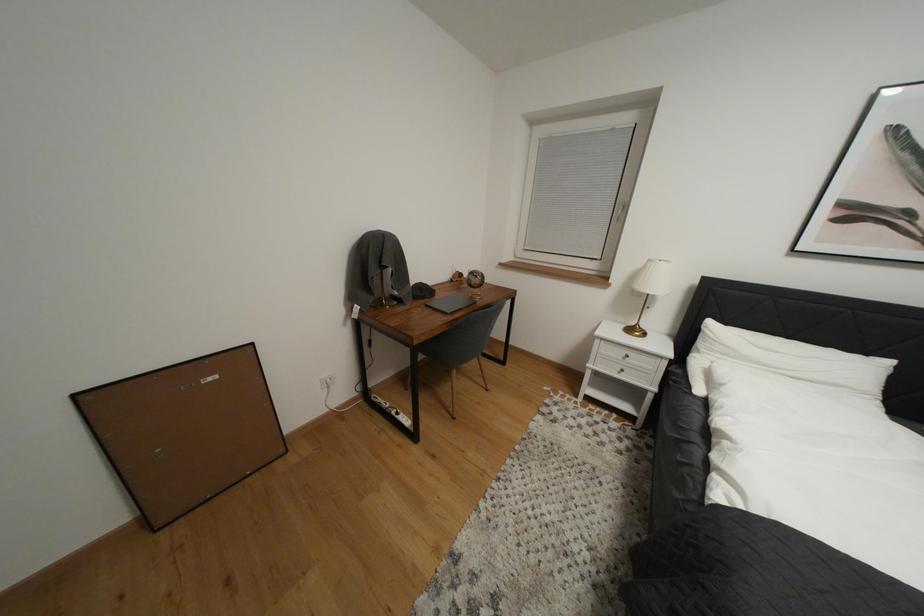
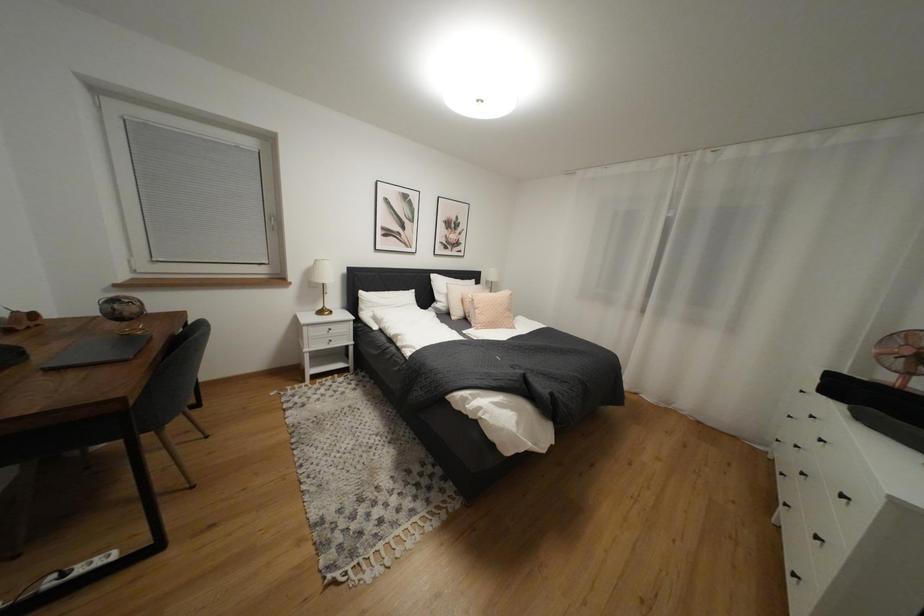
Question: The camera is either moving clockwise (left) or counter-clockwise (right) around the object. The first image is from the beginning of the video and the second image is from the end. Is the camera moving left or right when shooting the video?

Choices:
 (A) Left
 (B) Right

Answer: (A)